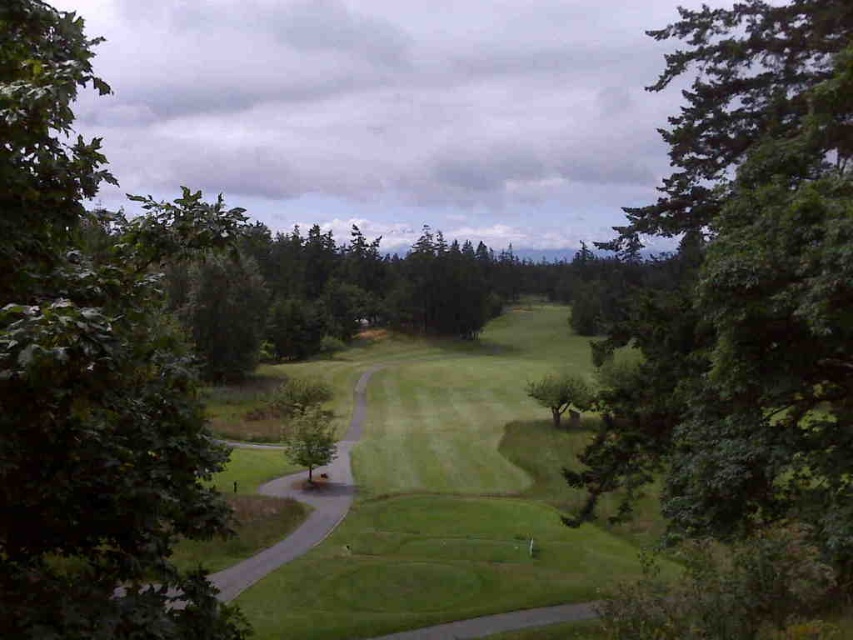
Question: Is green grassy field at center wider than green leafy tree at center?

Choices:
 (A) yes
 (B) no

Answer: (A)

Question: Which object is closer to the camera taking this photo?

Choices:
 (A) green matte tree at center-right
 (B) green grassy path at center
 (C) green leafy tree at left
 (D) green grassy field at center

Answer: (C)

Question: Which point is closer to the camera?

Choices:
 (A) green leafy tree at center
 (B) green leafy tree at left
 (C) green grassy field at center

Answer: (B)

Question: Is green grassy field at center to the right of green grassy path at center from the viewer's perspective?

Choices:
 (A) no
 (B) yes

Answer: (B)

Question: Estimate the real-world distances between objects in this image. Which object is farther from the green leafy tree at center?

Choices:
 (A) green leafy tree at right
 (B) green matte tree at center-right
 (C) green grassy path at center
 (D) green leafy tree at left

Answer: (A)

Question: Is green leafy tree at right wider than green grassy path at center?

Choices:
 (A) no
 (B) yes

Answer: (B)